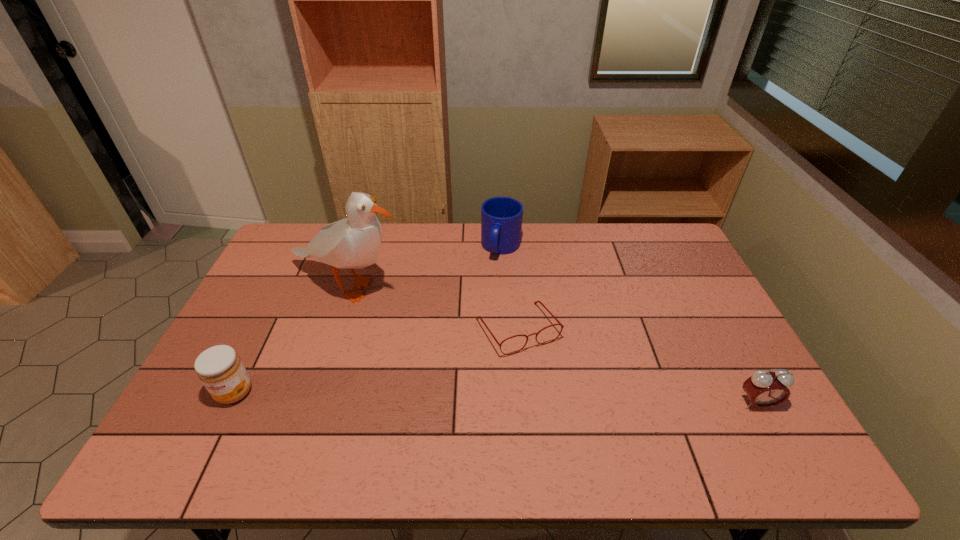
Find the location of a particular element. This screenshot has height=540, width=960. free location located 0.120m on the face of the shortest object is located at coordinates (558, 393).

Locate an element on the screen. Image resolution: width=960 pixels, height=540 pixels. free location located at the beak of the tallest object is located at coordinates click(404, 335).

I want to click on vacant space located at the beak of the tallest object, so click(437, 375).

Locate an element on the screen. free spot located at the beak of the tallest object is located at coordinates (413, 346).

Find the location of `mug that is at the far edge`. mug that is at the far edge is located at coordinates (501, 217).

The image size is (960, 540). In order to click on gull that is positioned at the far edge in this screenshot , I will do `click(352, 243)`.

Identify the location of jam that is at the near edge. The height and width of the screenshot is (540, 960). (220, 369).

I want to click on alarm clock that is at the near edge, so click(x=765, y=389).

Identify the location of jam that is at the left edge. The image size is (960, 540). (220, 369).

Identify the location of gull that is at the left edge. (352, 243).